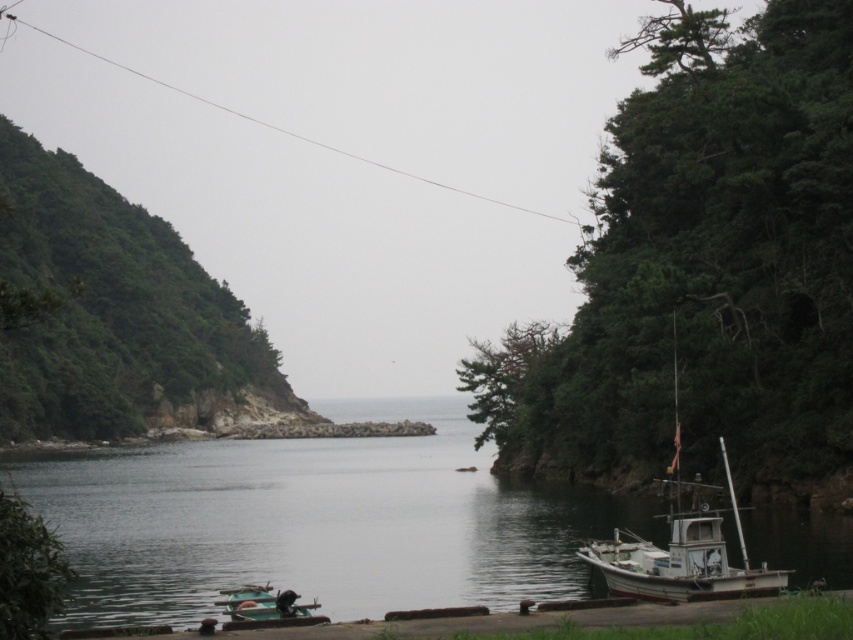
Question: Can you confirm if green leafy hillside at left is bigger than green matte boat at lower left?

Choices:
 (A) no
 (B) yes

Answer: (B)

Question: Which point is closer to the camera?

Choices:
 (A) [x=666, y=147]
 (B) [x=293, y=625]
 (C) [x=247, y=465]

Answer: (B)

Question: Does green leafy hillside at left appear on the right side of green matte boat at lower left?

Choices:
 (A) yes
 (B) no

Answer: (B)

Question: Which object appears closest to the camera in this image?

Choices:
 (A) green leafy hillside at left
 (B) smooth dark water at center

Answer: (A)

Question: Which point is farther to the camera?

Choices:
 (A) (265, 595)
 (B) (680, 596)

Answer: (A)

Question: Does white matte boat at right lie in front of green matte boat at lower left?

Choices:
 (A) no
 (B) yes

Answer: (A)